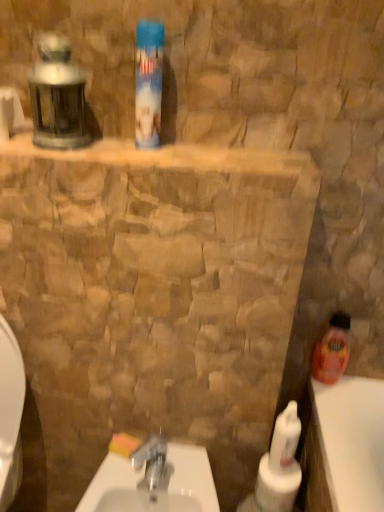
Locate an element on the screen. This screenshot has height=512, width=384. free space in front of blue plastic can at upper center, arranged as the 3th cleaning product when viewed from the back is located at coordinates (146, 155).